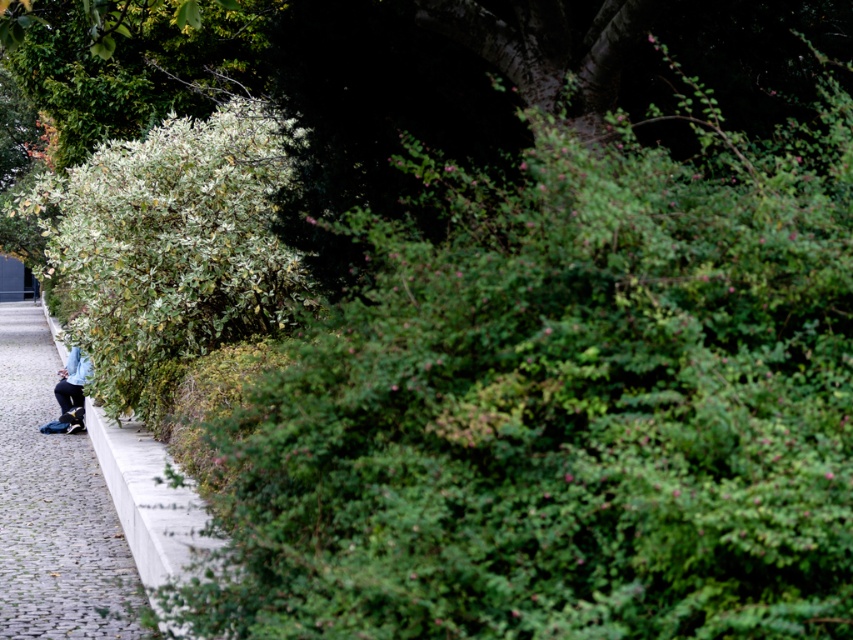
You are standing at the entrance of the pathway and want to reach the gray concrete pavement at lower left. Based on the coordinates provided in the description, in which direction should you walk to find it?

The gray concrete pavement at lower left is located at coordinates point (54, 506). Since lower left typically corresponds to lower coordinates on a standard grid, you should walk towards the lower left direction from your current position to reach it.